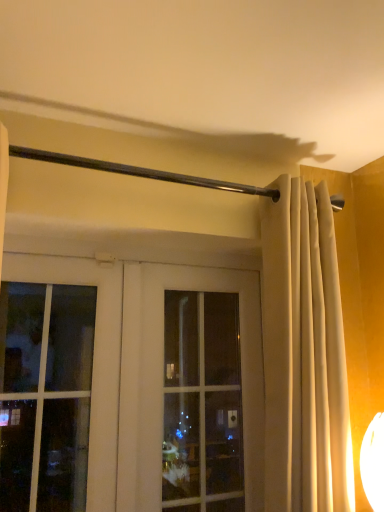
What do you see at coordinates (163, 372) in the screenshot? I see `clear glass window at center` at bounding box center [163, 372].

At what (x,y) coordinates should I click in order to perform the action: click on beige fabric curtain at center. Please return your answer as a coordinate pair (x, y). This screenshot has width=384, height=512. Looking at the image, I should click on coord(304,354).

The height and width of the screenshot is (512, 384). I want to click on white glass door at center, so click(162, 373).

From the image's perspective, is white glass door at center on top of beige fabric curtain at center?

No.

Does white glass door at center turn towards beige fabric curtain at center?

Yes, white glass door at center is facing beige fabric curtain at center.

Which is behind, white glass door at center or beige fabric curtain at center?

white glass door at center is further from the camera.

Can beige fabric curtain at center be found inside white glass door at center?

No, beige fabric curtain at center is not inside white glass door at center.

Is clear glass window at center at the right side of white glass door at center?

Yes, clear glass window at center is to the right of white glass door at center.

From a real-world perspective, is clear glass window at center over white glass door at center?

Incorrect, from a real-world perspective, clear glass window at center is lower than white glass door at center.

In the image, is clear glass window at center positioned in front of or behind white glass door at center?

In the image, clear glass window at center appears behind white glass door at center.

Is clear glass window at center directly adjacent to white glass door at center?

Yes, clear glass window at center is right next to white glass door at center and making contact.

From the image's perspective, would you say white glass door at center is shown under clear glass window at center?

No, from the image's perspective, white glass door at center is not below clear glass window at center.

Between white glass door at center and clear glass window at center, which one is positioned in front?

white glass door at center is more forward.

Which is behind, point (246, 312) or point (152, 411)?

The point (246, 312) is more distant.

Can you confirm if white glass door at center is positioned to the left of clear glass window at center?

Yes, white glass door at center is to the left of clear glass window at center.

Is clear glass window at center turned away from beige fabric curtain at center?

Yes.

From a real-world perspective, is clear glass window at center above or below beige fabric curtain at center?

Clearly, from a real-world perspective, clear glass window at center is below beige fabric curtain at center.

Is point (187, 283) positioned after point (336, 351)?

Yes, it is behind point (336, 351).

Which object is positioned more to the left, clear glass window at center or beige fabric curtain at center?

clear glass window at center is more to the left.

Can you tell me how much beige fabric curtain at center and white glass door at center differ in facing direction?

The angle between the facing direction of beige fabric curtain at center and the facing direction of white glass door at center is 1.45 degrees.

Is beige fabric curtain at center closer to camera compared to white glass door at center?

Yes, beige fabric curtain at center is closer to the viewer.

Considering the relative sizes of beige fabric curtain at center and white glass door at center in the image provided, is beige fabric curtain at center bigger than white glass door at center?

Correct, beige fabric curtain at center is larger in size than white glass door at center.

Is beige fabric curtain at center placed right next to white glass door at center?

They are not placed beside each other.

How different are the orientations of beige fabric curtain at center and clear glass window at center in degrees?

The facing directions of beige fabric curtain at center and clear glass window at center are 0.989 degrees apart.

Does beige fabric curtain at center lie behind clear glass window at center?

No, it is in front of clear glass window at center.

From the picture: Does beige fabric curtain at center touch clear glass window at center?

No.

Is beige fabric curtain at center facing towards clear glass window at center?

No, beige fabric curtain at center is not oriented towards clear glass window at center.

At what (x,y) coordinates should I click in order to perform the action: click on curtain in front of the white glass door at center. Please return your answer as a coordinate pair (x, y). Looking at the image, I should click on (304, 354).

Locate an element on the screen. Image resolution: width=384 pixels, height=512 pixels. window on the right side of white glass door at center is located at coordinates (163, 372).

Based on their spatial positions, is beige fabric curtain at center or clear glass window at center further from white glass door at center?

Based on the image, beige fabric curtain at center appears to be further to white glass door at center.

Which object lies further to the anchor point beige fabric curtain at center, white glass door at center or clear glass window at center?

white glass door at center is further to beige fabric curtain at center.

From the image, which object appears to be farther from white glass door at center, clear glass window at center or beige fabric curtain at center?

beige fabric curtain at center is further to white glass door at center.

Considering their positions, is white glass door at center positioned closer to clear glass window at center than beige fabric curtain at center?

The object closer to clear glass window at center is white glass door at center.

Estimate the real-world distances between objects in this image. Which object is closer to clear glass window at center, beige fabric curtain at center or white glass door at center?

The object closer to clear glass window at center is white glass door at center.

Looking at the image, which one is located further to beige fabric curtain at center, clear glass window at center or white glass door at center?

Based on the image, white glass door at center appears to be further to beige fabric curtain at center.

Find the location of a particular element. The image size is (384, 512). window situated between white glass door at center and beige fabric curtain at center from left to right is located at coordinates [163, 372].